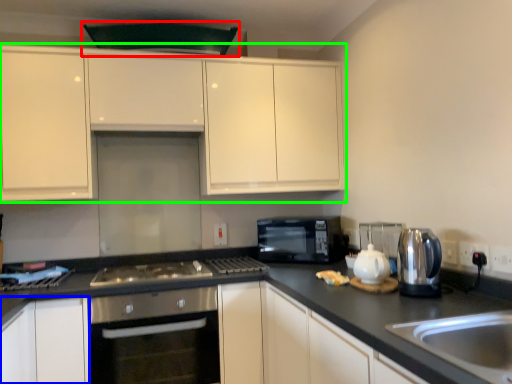
Question: Which object is positioned closest to exhaust hood (highlighted by a red box)? Select from cabinetry (highlighted by a blue box) and cabinetry (highlighted by a green box).

Choices:
 (A) cabinetry
 (B) cabinetry

Answer: (B)